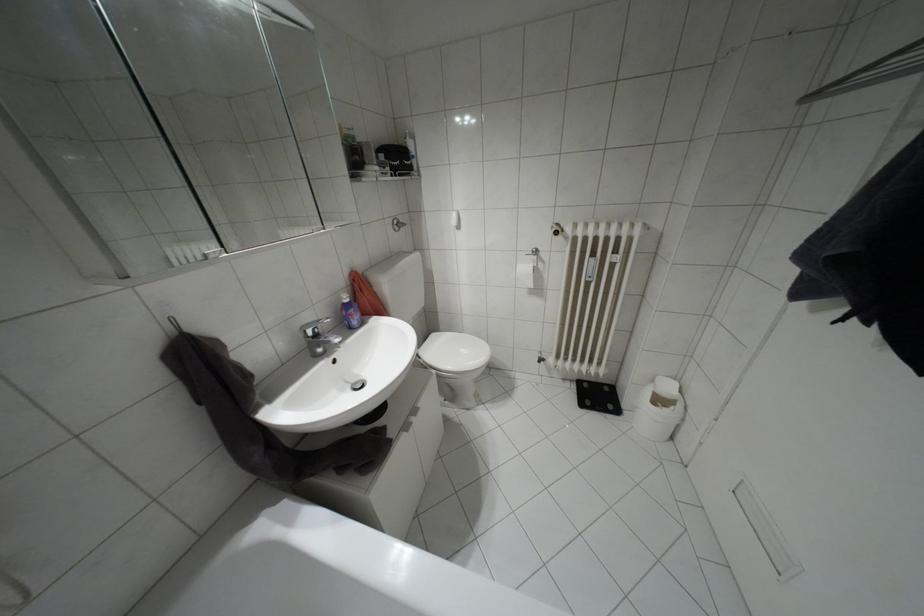
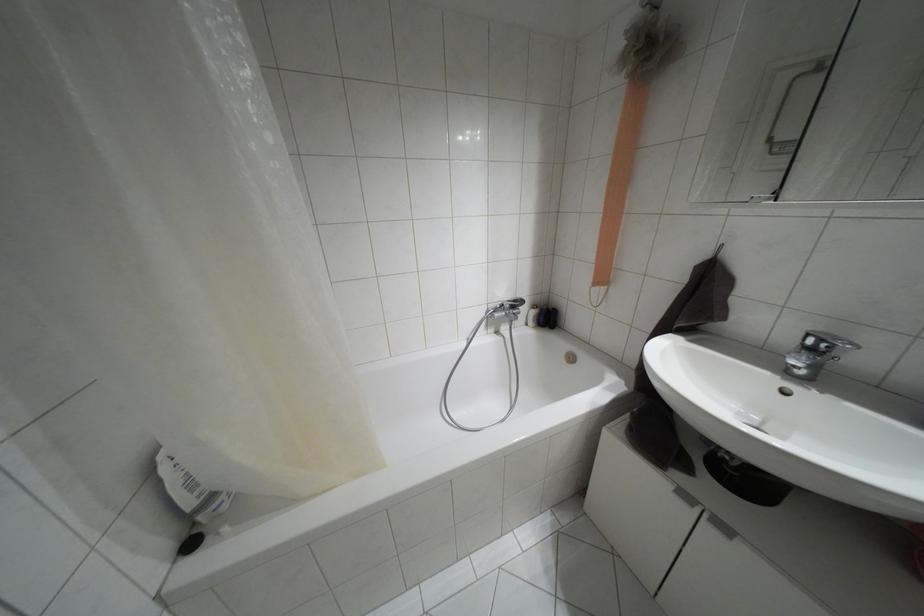
Find the pixel in the second image that matches [406,427] in the first image.

(685, 496)